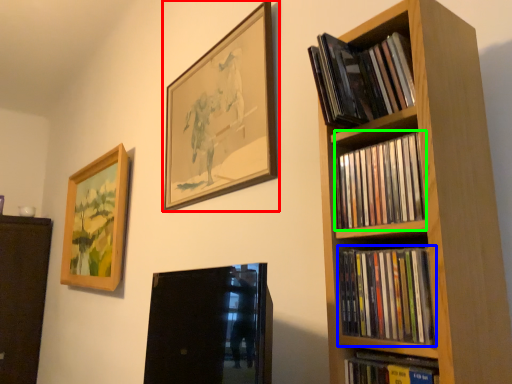
Question: Which object is positioned closest to picture frame (highlighted by a red box)? Select from book (highlighted by a blue box) and book (highlighted by a green box).

Choices:
 (A) book
 (B) book

Answer: (B)